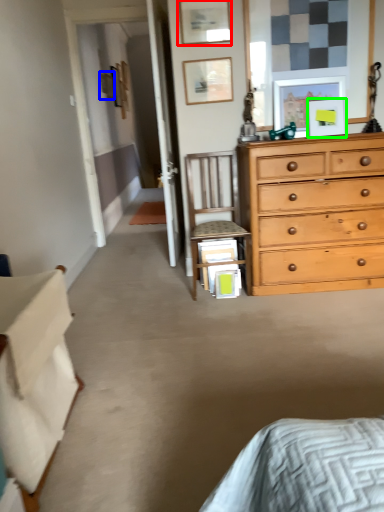
Question: Which object is the closest to the picture frame (highlighted by a red box)? Choose among these: picture frame (highlighted by a blue box) or picture frame (highlighted by a green box).

Choices:
 (A) picture frame
 (B) picture frame

Answer: (B)